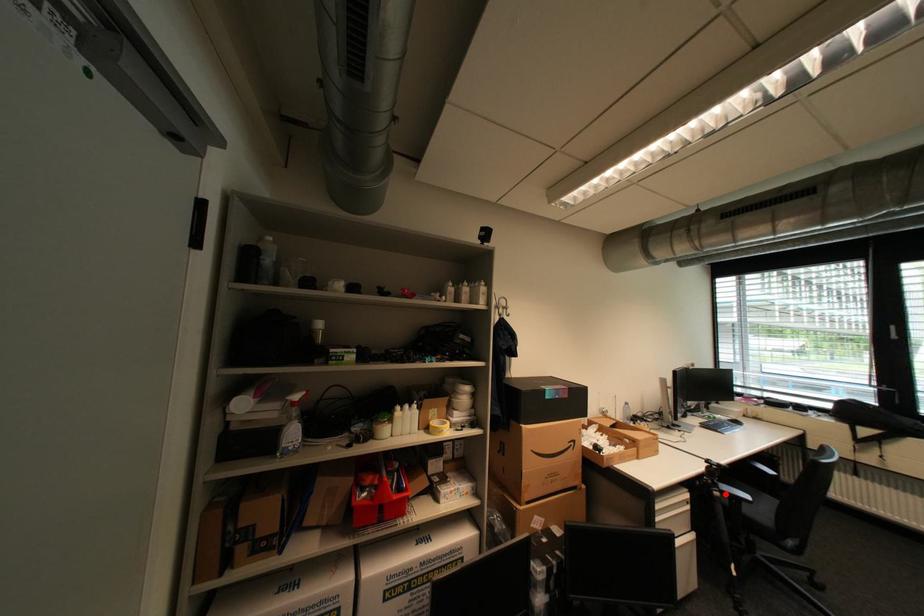
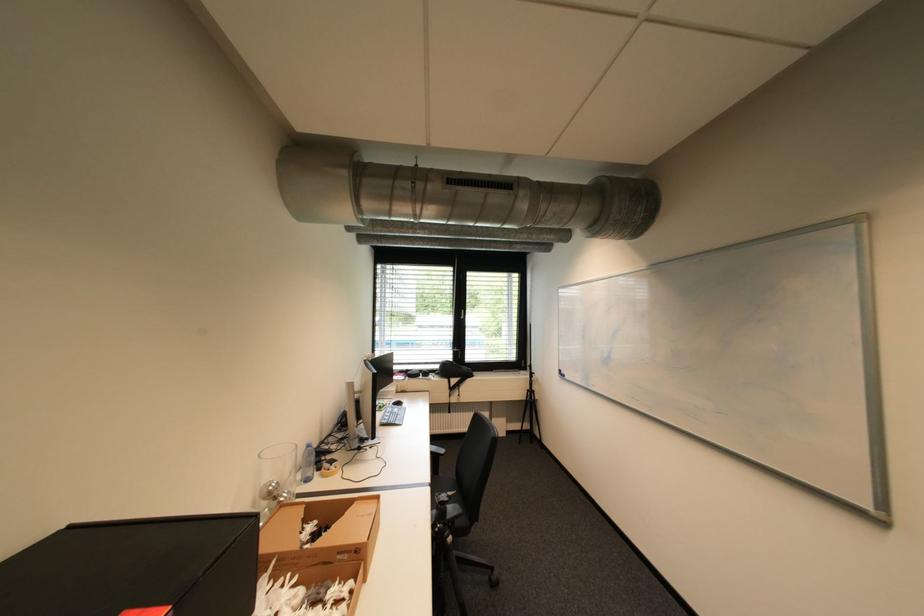
Find the pixel in the second image that matches the highlighted location in the first image.

(458, 540)